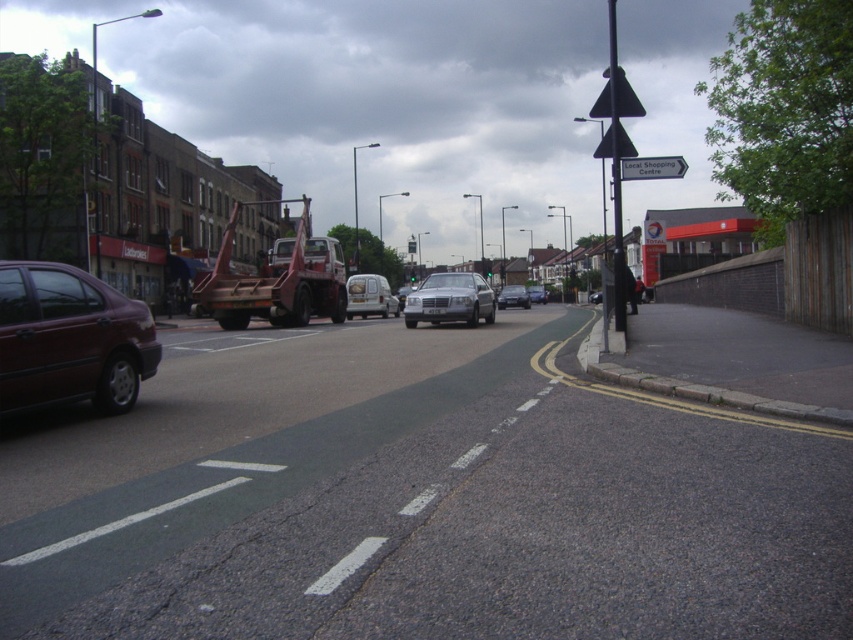
Who is more forward, (428, 284) or (639, 179)?

Point (639, 179)

Which is below, satin silver car at center or white plastic sign at upper center?

satin silver car at center

This screenshot has width=853, height=640. What are the coordinates of `satin silver car at center` in the screenshot? It's located at (450, 300).

Who is higher up, matte maroon sedan at left or white plastic sign at upper center?

white plastic sign at upper center

Measure the distance between matte maroon sedan at left and camera.

matte maroon sedan at left and camera are 8.60 meters apart.

Where is `matte maroon sedan at left`? matte maroon sedan at left is located at coordinates (70, 339).

Locate an element on the screen. matte maroon sedan at left is located at coordinates (70, 339).

Between satin silver car at center and satin silver sedan at center, which one appears on the right side from the viewer's perspective?

satin silver sedan at center is more to the right.

Is point (485, 298) in front of point (509, 285)?

That is True.

The width and height of the screenshot is (853, 640). Describe the element at coordinates (450, 300) in the screenshot. I see `satin silver car at center` at that location.

This screenshot has height=640, width=853. I want to click on satin silver car at center, so click(450, 300).